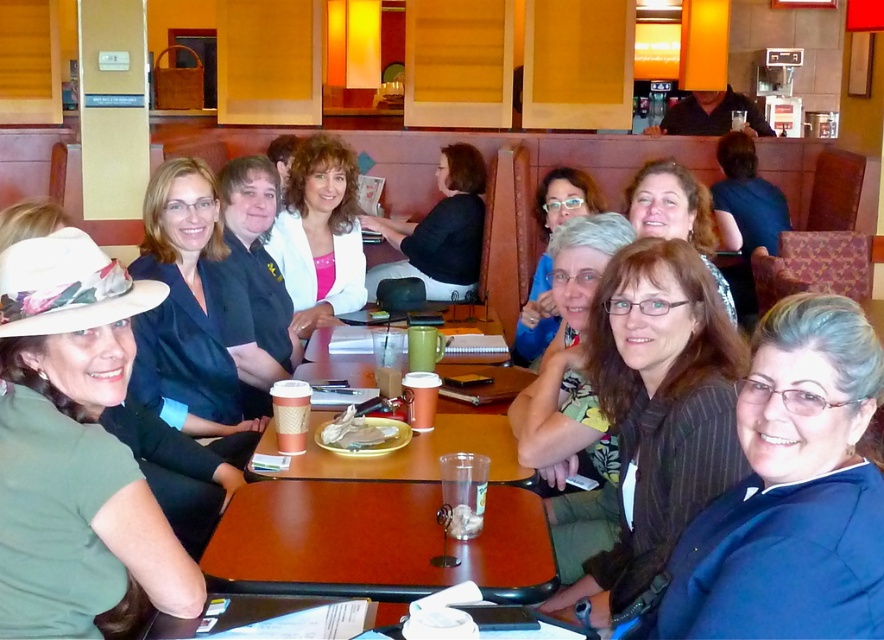
Can you confirm if floral print blouse at center is smaller than matte black shirt at center?

Yes, floral print blouse at center is smaller than matte black shirt at center.

Does point (578, 556) lie in front of point (698, 209)?

That is True.

What do you see at coordinates (573, 397) in the screenshot? I see `floral print blouse at center` at bounding box center [573, 397].

Image resolution: width=884 pixels, height=640 pixels. I want to click on floral print blouse at center, so click(x=573, y=397).

Is green fabric hat at left shorter than black matte shirt at center?

Indeed, green fabric hat at left has a lesser height compared to black matte shirt at center.

Between green fabric hat at left and black matte shirt at center, which one appears on the left side from the viewer's perspective?

green fabric hat at left is more to the left.

Is point (28, 596) farther from camera compared to point (448, 289)?

No, it is in front of (448, 289).

The height and width of the screenshot is (640, 884). Identify the location of green fabric hat at left. (74, 448).

This screenshot has width=884, height=640. I want to click on blue pinstripe blazer at lower right, so click(791, 492).

Who is taller, blue pinstripe blazer at lower right or matte black blazer at center?

Standing taller between the two is matte black blazer at center.

Is point (756, 556) farther from viewer compared to point (170, 396)?

That is False.

The image size is (884, 640). In order to click on blue pinstripe blazer at lower right in this screenshot , I will do `click(791, 492)`.